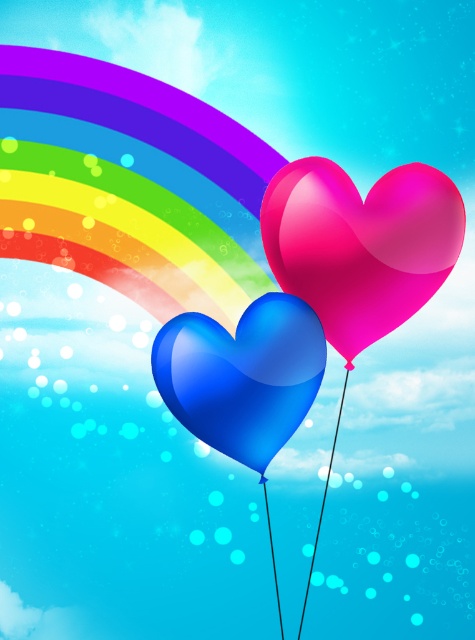
The height and width of the screenshot is (640, 475). Identify the location of glossy pink heart at center. click(x=361, y=244).

Does point (305, 160) lie behind point (193, 392)?

Yes, point (305, 160) is behind point (193, 392).

The width and height of the screenshot is (475, 640). Find the location of `glossy pink heart at center`. glossy pink heart at center is located at coordinates (361, 244).